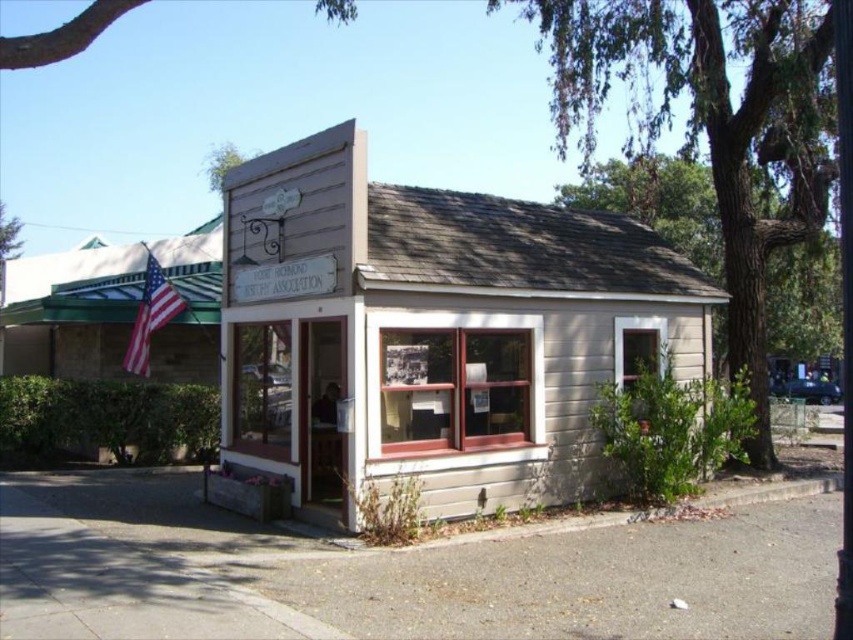
Question: Considering the relative positions of wooden signboard at center and matte american flag at left in the image provided, where is wooden signboard at center located with respect to matte american flag at left?

Choices:
 (A) left
 (B) right

Answer: (B)

Question: Which point appears farthest from the camera in this image?

Choices:
 (A) (633, 346)
 (B) (146, 262)

Answer: (B)

Question: Can you confirm if wooden signboard at center is positioned to the left of matte american flag at left?

Choices:
 (A) yes
 (B) no

Answer: (B)

Question: Is wooden signboard at center above matte american flag at left?

Choices:
 (A) no
 (B) yes

Answer: (A)

Question: Which object appears closest to the camera in this image?

Choices:
 (A) wooden signboard at center
 (B) matte american flag at left

Answer: (A)